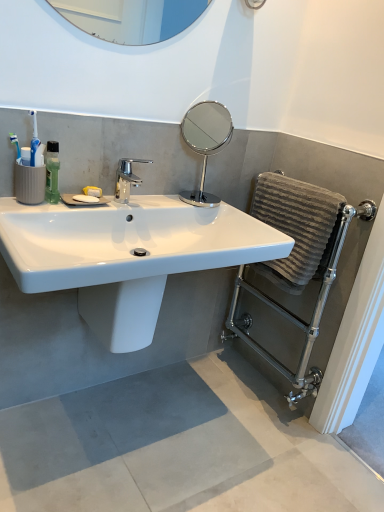
Identify the location of free space below gray textured towel at right (from a real-world perspective). (247, 389).